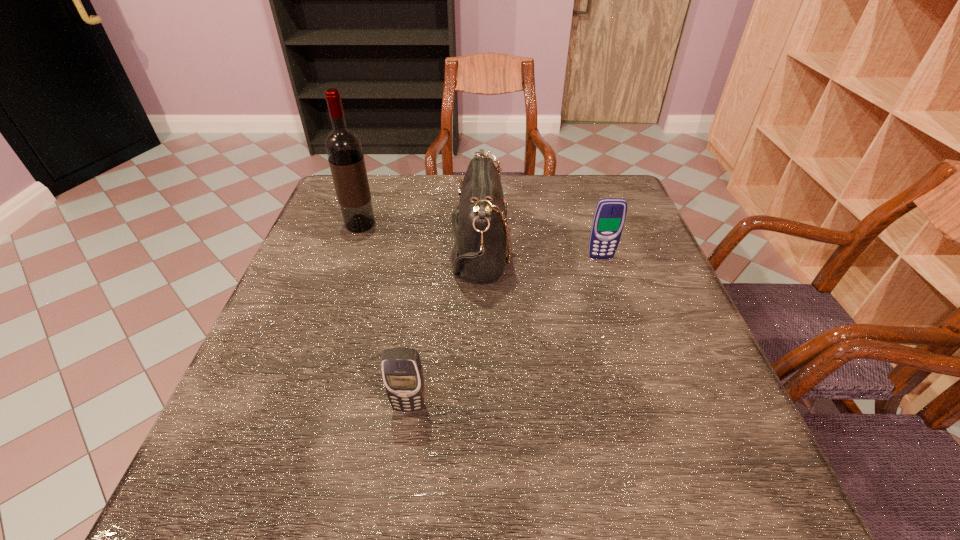
In the image, there is a desktop. Identify the location of vacant space at the right edge. The width and height of the screenshot is (960, 540). (694, 341).

Where is `vacant region at the far right corner`? The height and width of the screenshot is (540, 960). vacant region at the far right corner is located at coordinates (633, 214).

Where is `vacant area that lies between the nearer cellular telephone and the leftmost object`? vacant area that lies between the nearer cellular telephone and the leftmost object is located at coordinates coord(385,316).

This screenshot has width=960, height=540. In order to click on free space between the tallest object and the second object from left to right in this screenshot , I will do `click(385, 316)`.

At what (x,y) coordinates should I click in order to perform the action: click on empty space between the farther cellular telephone and the second object from left to right. Please return your answer as a coordinate pair (x, y). The image size is (960, 540). Looking at the image, I should click on (505, 332).

Find the location of a particular element. The height and width of the screenshot is (540, 960). free space that is in between the handbag and the wine bottle is located at coordinates (420, 237).

Locate an element on the screen. The image size is (960, 540). free space between the rightmost object and the third object from right to left is located at coordinates point(505,332).

I want to click on free space between the second object from left to right and the handbag, so click(x=444, y=328).

I want to click on vacant point located between the right cellular telephone and the handbag, so click(x=540, y=253).

Locate an element on the screen. Image resolution: width=960 pixels, height=540 pixels. vacant space that is in between the leftmost object and the handbag is located at coordinates (420, 237).